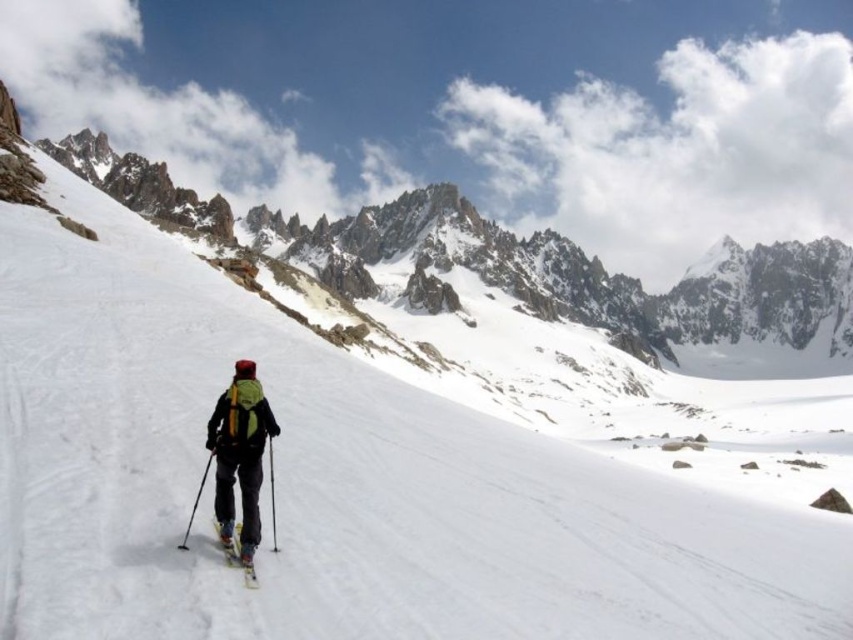
You are a cross country skier who just arrived at the snowy terrain. You notice a yellow matte ski at lower center. Where exactly is it located?

The yellow matte ski at lower center is located at point (x=238, y=557).

You are a photographer trying to capture the skier and their equipment. You notice the yellow matte ski at lower center and the black plastic ski pole at center. Which object is positioned to the left when viewed from the photographer perspective?

The yellow matte ski at lower center is to the left of the black plastic ski pole at center.

You are standing at the point marked as point (270,464) in the alpine scene. You want to ski down to the base of the mountain, which is located at the lowest point of the snowfield. Can you estimate how far you need to ski from your current position to reach the base?

The distance between point (270,464) and the viewer is 52.79 meters. Since the base of the mountain is at the lowest point of the snowfield, which is likely the same as the viewer position, you need to ski approximately 52.79 meters to reach the base.